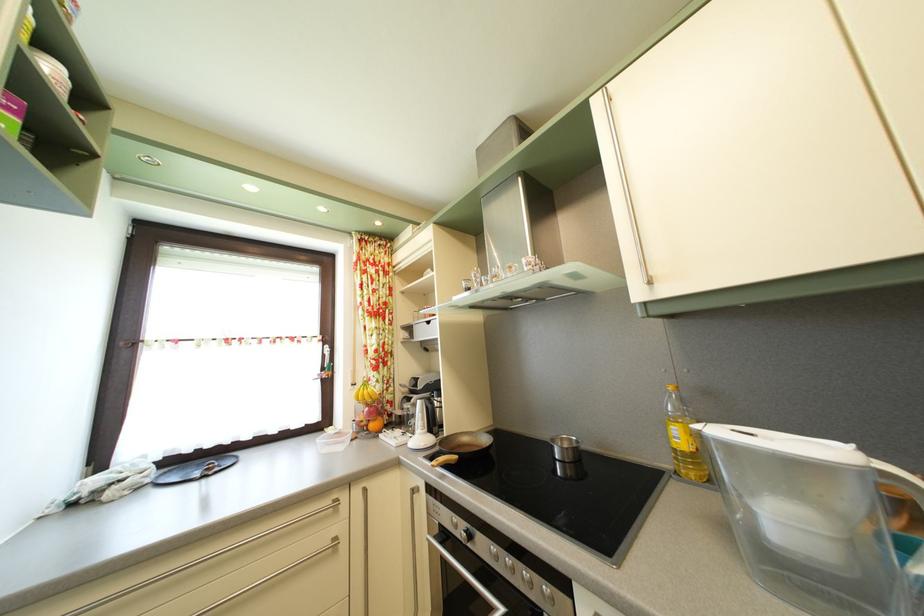
What do you see at coordinates (625, 188) in the screenshot?
I see `a metal cabinet handle` at bounding box center [625, 188].